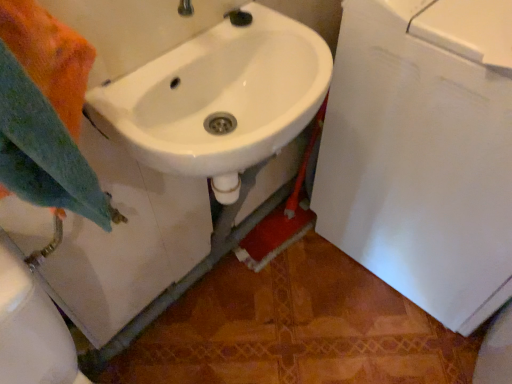
Image resolution: width=512 pixels, height=384 pixels. Describe the element at coordinates (221, 98) in the screenshot. I see `white glossy sink at center` at that location.

Locate an element on the screen. Image resolution: width=512 pixels, height=384 pixels. white glossy sink at center is located at coordinates (221, 98).

What do you see at coordinates (42, 150) in the screenshot? Image resolution: width=512 pixels, height=384 pixels. I see `orange fabric towel at left` at bounding box center [42, 150].

Find the location of a particular element. The height and width of the screenshot is (384, 512). orange fabric towel at left is located at coordinates (42, 150).

Locate an element on the screen. This screenshot has width=512, height=384. white glossy sink at center is located at coordinates (221, 98).

Is white glossy sink at center to the left or to the right of orange fabric towel at left in the image?

white glossy sink at center is positioned on orange fabric towel at left's right side.

Which object is closer to the camera taking this photo, white glossy sink at center or orange fabric towel at left?

orange fabric towel at left is more forward.

Between point (162, 123) and point (8, 59), which one is positioned behind?

The point (162, 123) is more distant.

From the image's perspective, is white glossy sink at center under orange fabric towel at left?

No, from the image's perspective, white glossy sink at center is not below orange fabric towel at left.

In the scene shown: From a real-world perspective, between white glossy sink at center and orange fabric towel at left, who is vertically higher?

orange fabric towel at left is physically above.

Based on the photo, in terms of width, does white glossy sink at center look wider or thinner when compared to orange fabric towel at left?

white glossy sink at center is wider than orange fabric towel at left.

Can you confirm if white glossy sink at center is shorter than orange fabric towel at left?

Correct, white glossy sink at center is not as tall as orange fabric towel at left.

Can you confirm if white glossy sink at center is bigger than orange fabric towel at left?

Yes, white glossy sink at center is bigger than orange fabric towel at left.

In the scene shown: Is white glossy sink at center spatially inside orange fabric towel at left, or outside of it?

white glossy sink at center lies outside orange fabric towel at left.

Looking at this image, would you say white glossy sink at center is a long distance from orange fabric towel at left?

white glossy sink at center is actually quite close to orange fabric towel at left.

Is white glossy sink at center looking in the opposite direction of orange fabric towel at left?

No, white glossy sink at center's orientation is not away from orange fabric towel at left.

What's the angular difference between white glossy sink at center and orange fabric towel at left's facing directions?

1.13 degrees.

Locate an element on the screen. The image size is (512, 384). bath towel above the white glossy sink at center (from a real-world perspective) is located at coordinates (42, 150).

Which is more to the left, orange fabric towel at left or white glossy sink at center?

orange fabric towel at left.

Is the position of orange fabric towel at left more distant than that of white glossy sink at center?

No, the depth of orange fabric towel at left is less than that of white glossy sink at center.

Considering the points (40, 201) and (250, 66), which point is behind, point (40, 201) or point (250, 66)?

Positioned behind is point (250, 66).

From the image's perspective, is orange fabric towel at left under white glossy sink at center?

Indeed, from the image's perspective, orange fabric towel at left is shown beneath white glossy sink at center.

From a real-world perspective, which is physically below, orange fabric towel at left or white glossy sink at center?

white glossy sink at center.

Is orange fabric towel at left wider than white glossy sink at center?

No, orange fabric towel at left is not wider than white glossy sink at center.

Between orange fabric towel at left and white glossy sink at center, which one has more height?

With more height is orange fabric towel at left.

Which of these two, orange fabric towel at left or white glossy sink at center, is smaller?

orange fabric towel at left.

Is orange fabric towel at left inside the boundaries of white glossy sink at center, or outside?

orange fabric towel at left cannot be found inside white glossy sink at center.

Is there a large distance between orange fabric towel at left and white glossy sink at center?

They are positioned close to each other.

Is orange fabric towel at left turned away from white glossy sink at center?

orange fabric towel at left does not have its back to white glossy sink at center.

How distant is orange fabric towel at left from white glossy sink at center?

orange fabric towel at left is 11.23 inches away from white glossy sink at center.

In order to click on sink on the right of orange fabric towel at left in this screenshot , I will do `click(221, 98)`.

This screenshot has width=512, height=384. I want to click on bath towel above the white glossy sink at center (from a real-world perspective), so click(42, 150).

You are a GUI agent. You are given a task and a screenshot of the screen. Output one action in this format:
    pyautogui.click(x=<x>, y=<y>)
    Task: Click on the sink behind the orange fabric towel at left
    
    Given the screenshot: What is the action you would take?
    pyautogui.click(x=221, y=98)